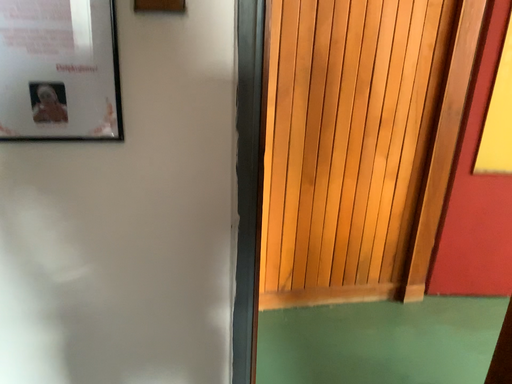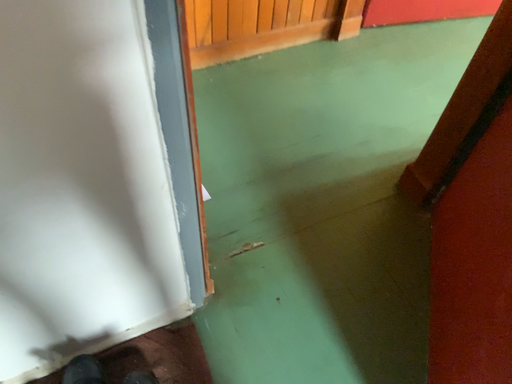
Question: Which way did the camera rotate in the video?

Choices:
 (A) rotated right
 (B) rotated left

Answer: (A)